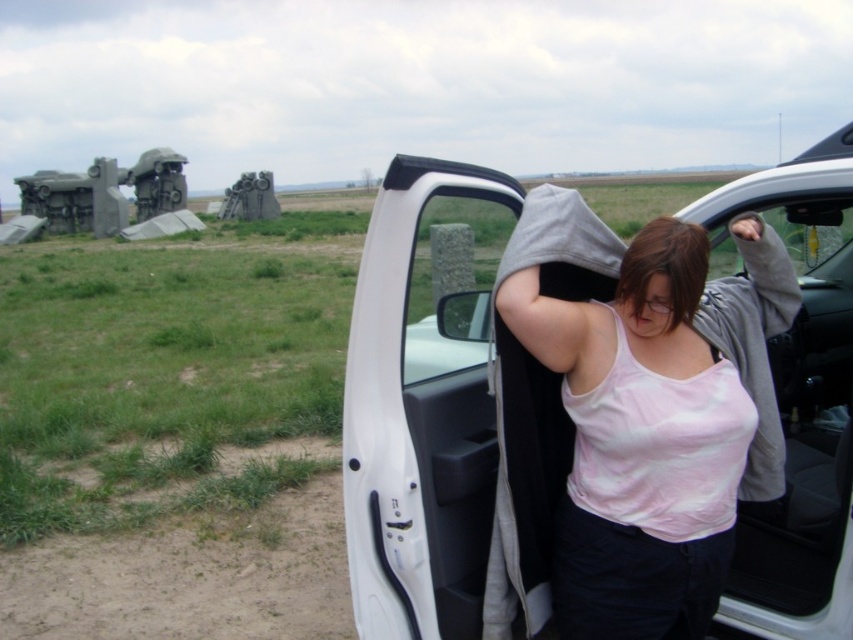
Question: Which of the following is the farthest from the observer?

Choices:
 (A) white matte car door at center
 (B) pink cotton tank top at center

Answer: (B)

Question: Which of the following is the farthest from the observer?

Choices:
 (A) (473, 612)
 (B) (561, 280)

Answer: (B)

Question: Is white matte car door at center to the left of pink cotton tank top at center from the viewer's perspective?

Choices:
 (A) no
 (B) yes

Answer: (B)

Question: Is white matte car door at center further to camera compared to pink cotton tank top at center?

Choices:
 (A) no
 (B) yes

Answer: (A)

Question: Is white matte car door at center positioned in front of pink cotton tank top at center?

Choices:
 (A) yes
 (B) no

Answer: (A)